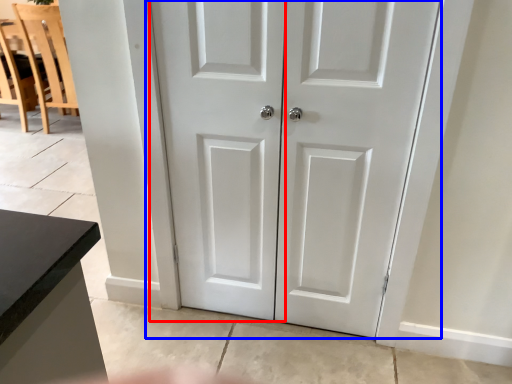
Question: Which object appears farthest to the camera in this image, screen door (highlighted by a red box) or door (highlighted by a blue box)?

Choices:
 (A) screen door
 (B) door

Answer: (A)